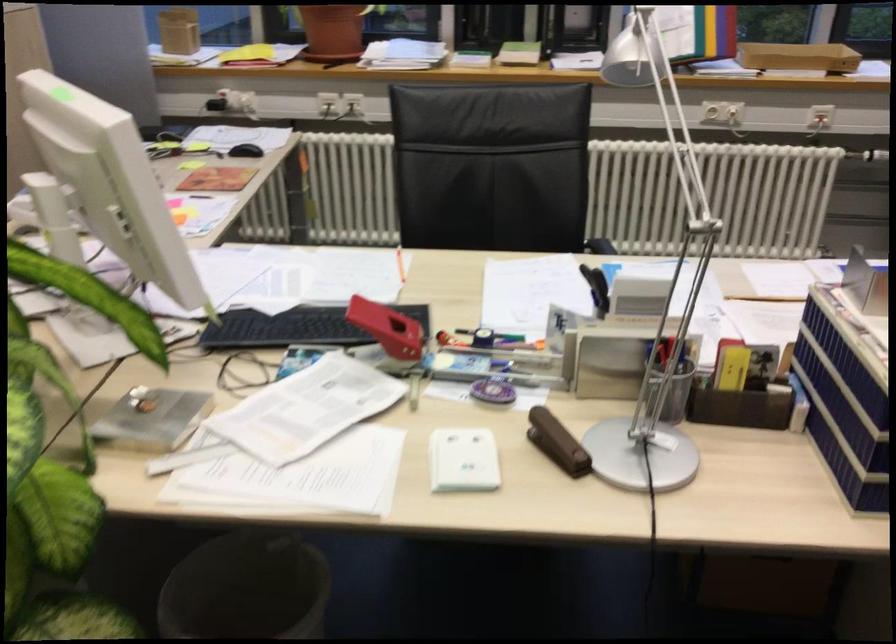
What do you see at coordinates (453, 265) in the screenshot?
I see `a chair sitting surface` at bounding box center [453, 265].